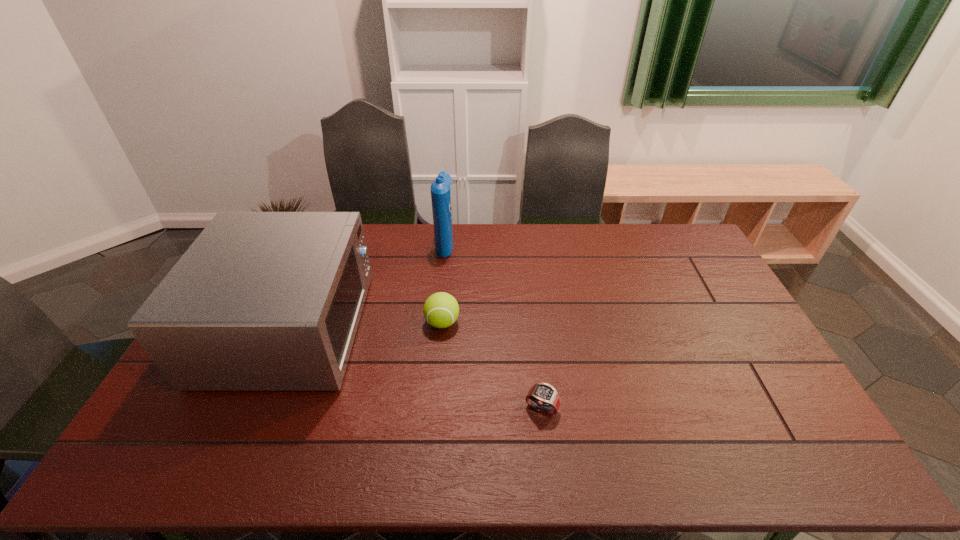
You are a GUI agent. You are given a task and a screenshot of the screen. Output one action in this format:
    pyautogui.click(x=<x>, y=<y>)
    Task: Click on the blank region between the tennis ball and the farthest object
    
    Given the screenshot: What is the action you would take?
    pyautogui.click(x=444, y=283)

Locate an element on the screen. The width and height of the screenshot is (960, 540). empty location between the tennis ball and the rightmost object is located at coordinates (492, 366).

Image resolution: width=960 pixels, height=540 pixels. In order to click on vacant area that lies between the microwave oven and the watch in this screenshot , I will do `click(416, 368)`.

This screenshot has width=960, height=540. Find the location of `vacant region between the watch and the third tallest object`. vacant region between the watch and the third tallest object is located at coordinates (492, 366).

Identify the location of object that ranks as the third closest to the microwave oven. The image size is (960, 540). (543, 397).

This screenshot has height=540, width=960. In order to click on the closest object to the third tallest object in this screenshot , I will do `click(261, 301)`.

Where is `vacant point that satisfies the following two spatial constraints: 1. with the door open on the leftmost object; 2. on the back side of the watch`? The image size is (960, 540). vacant point that satisfies the following two spatial constraints: 1. with the door open on the leftmost object; 2. on the back side of the watch is located at coordinates (255, 408).

Where is `vacant area in the image that satisfies the following two spatial constraints: 1. on the front side of the shortest object; 2. on the left side of the farthest object`? vacant area in the image that satisfies the following two spatial constraints: 1. on the front side of the shortest object; 2. on the left side of the farthest object is located at coordinates (429, 408).

Locate an element on the screen. vacant space that satisfies the following two spatial constraints: 1. with the door open on the leftmost object; 2. on the back side of the nearest object is located at coordinates (255, 408).

Locate an element on the screen. The image size is (960, 540). vacant region that satisfies the following two spatial constraints: 1. on the front side of the rightmost object; 2. on the right side of the farthest object is located at coordinates (429, 408).